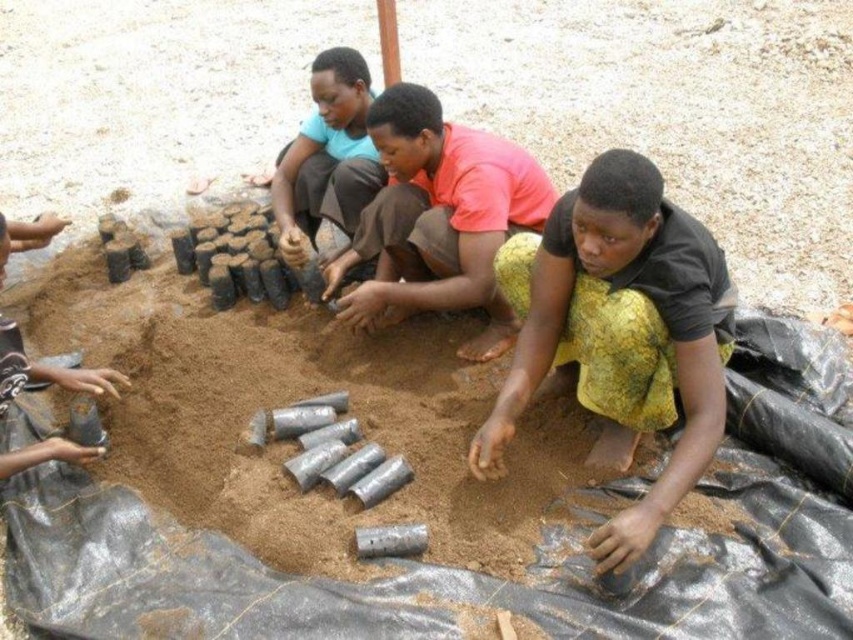
Question: Which object appears farthest from the camera in this image?

Choices:
 (A) yellow textured cloth at center
 (B) brown sandy soil at center

Answer: (A)

Question: Is yellow textured cloth at center positioned before matte black pot at lower left?

Choices:
 (A) yes
 (B) no

Answer: (A)

Question: Which point is closer to the camera?

Choices:
 (A) (315, 180)
 (B) (686, 381)
 (C) (495, 237)
 (D) (113, 385)

Answer: (B)

Question: Which point is closer to the camera?

Choices:
 (A) matte black pot at lower left
 (B) brown sandy soil at center
 (C) pink matte shirt at center

Answer: (B)

Question: Is brown sandy soil at center positioned in front of yellow textured cloth at center?

Choices:
 (A) no
 (B) yes

Answer: (B)

Question: Is matte brown shirt at center to the right of matte black pot at lower left from the viewer's perspective?

Choices:
 (A) yes
 (B) no

Answer: (A)